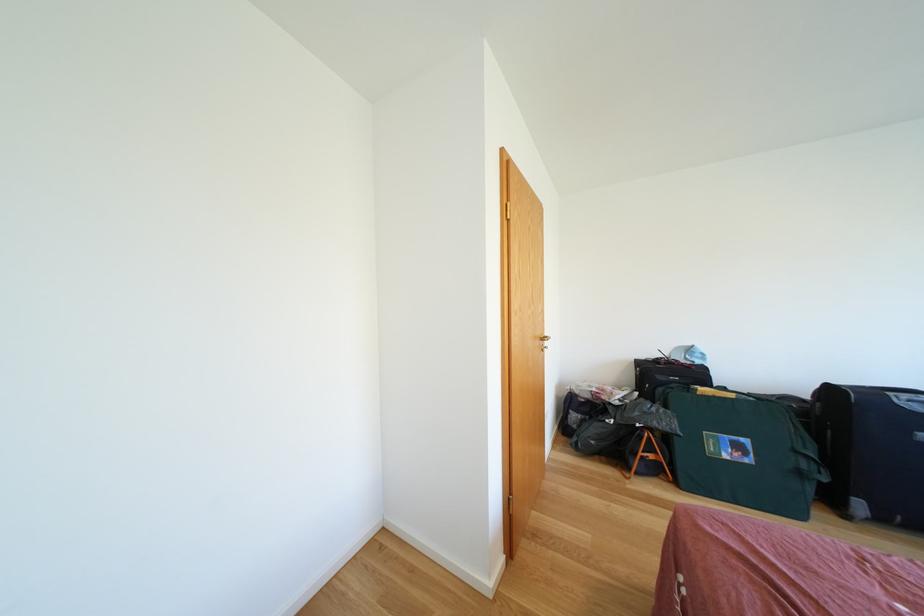
Locate an element on the screen. green bag handle is located at coordinates coord(744,452).